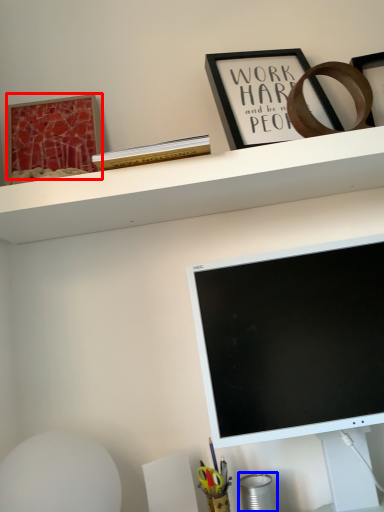
Question: Which object is further to the camera taking this photo, picture frame (highlighted by a red box) or stationery (highlighted by a blue box)?

Choices:
 (A) picture frame
 (B) stationery

Answer: (A)